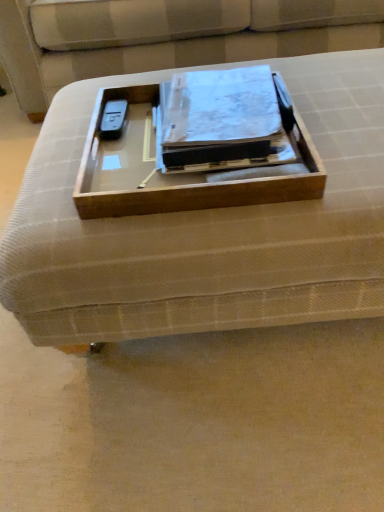
Question: Does beige fabric couch at center appear on the right side of matte plastic binder at center?

Choices:
 (A) no
 (B) yes

Answer: (B)

Question: Is beige fabric couch at center in contact with matte plastic binder at center?

Choices:
 (A) no
 (B) yes

Answer: (A)

Question: Is beige fabric couch at center not close to matte plastic binder at center?

Choices:
 (A) no
 (B) yes

Answer: (A)

Question: Can you confirm if beige fabric couch at center is shorter than matte plastic binder at center?

Choices:
 (A) no
 (B) yes

Answer: (A)

Question: Would you say beige fabric couch at center is outside matte plastic binder at center?

Choices:
 (A) no
 (B) yes

Answer: (B)

Question: Is point (120, 243) closer or farther from the camera than point (233, 110)?

Choices:
 (A) closer
 (B) farther

Answer: (A)

Question: In the image, is wooden tray at center positioned in front of or behind matte plastic binder at center?

Choices:
 (A) front
 (B) behind

Answer: (A)

Question: Is wooden tray at center bigger or smaller than matte plastic binder at center?

Choices:
 (A) big
 (B) small

Answer: (A)

Question: From the image's perspective, is wooden tray at center positioned above or below matte plastic binder at center?

Choices:
 (A) above
 (B) below

Answer: (B)

Question: Considering the positions of wooden tray at center and wooden tray at center in the image, is wooden tray at center bigger or smaller than wooden tray at center?

Choices:
 (A) small
 (B) big

Answer: (A)

Question: Do you think wooden tray at center is within wooden tray at center, or outside of it?

Choices:
 (A) inside
 (B) outside

Answer: (B)

Question: Does point (150, 151) appear closer or farther from the camera than point (278, 268)?

Choices:
 (A) closer
 (B) farther

Answer: (B)

Question: From the image's perspective, relative to wooden tray at center, is wooden tray at center above or below?

Choices:
 (A) below
 (B) above

Answer: (B)

Question: Do you think wooden tray at center is within beige fabric couch at center, or outside of it?

Choices:
 (A) inside
 (B) outside

Answer: (B)

Question: From a real-world perspective, is wooden tray at center above or below beige fabric couch at center?

Choices:
 (A) above
 (B) below

Answer: (A)